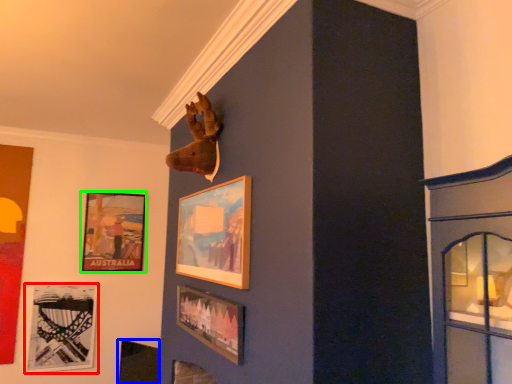
Question: Which object is the closest to the picture frame (highlighted by a red box)? Choose among these: picture frame (highlighted by a blue box) or picture frame (highlighted by a green box).

Choices:
 (A) picture frame
 (B) picture frame

Answer: (A)